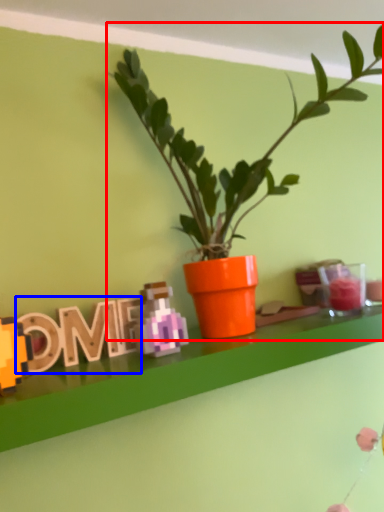
Question: Which object appears closest to the camera in this image, houseplant (highlighted by a red box) or alphabet (highlighted by a blue box)?

Choices:
 (A) houseplant
 (B) alphabet

Answer: (A)